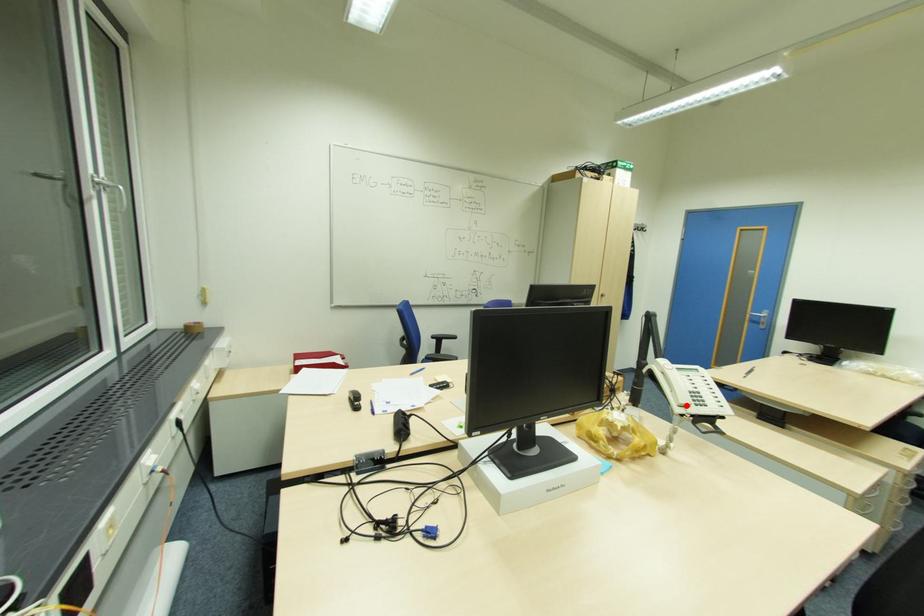
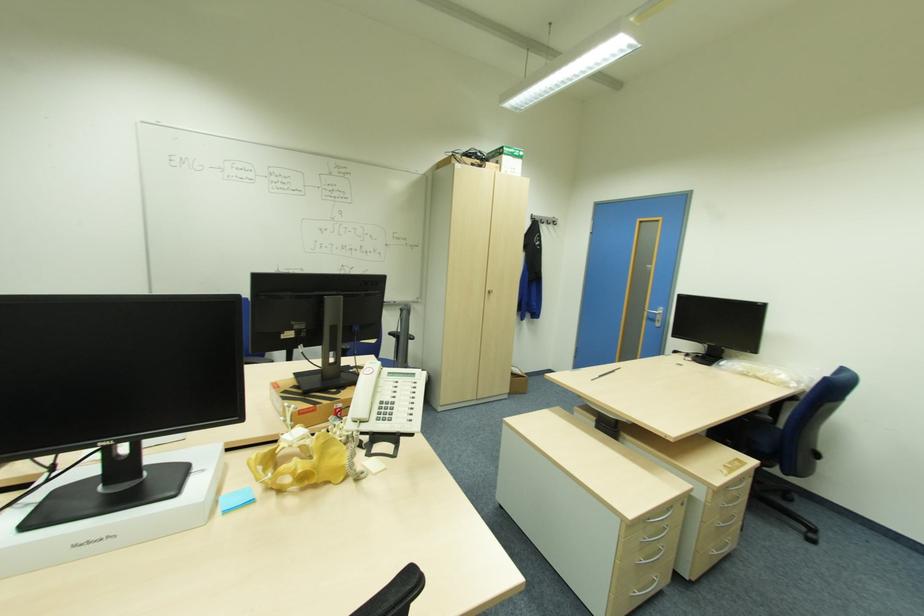
In the second image, find the point that corresponds to the highlighted location in the first image.

(359, 422)